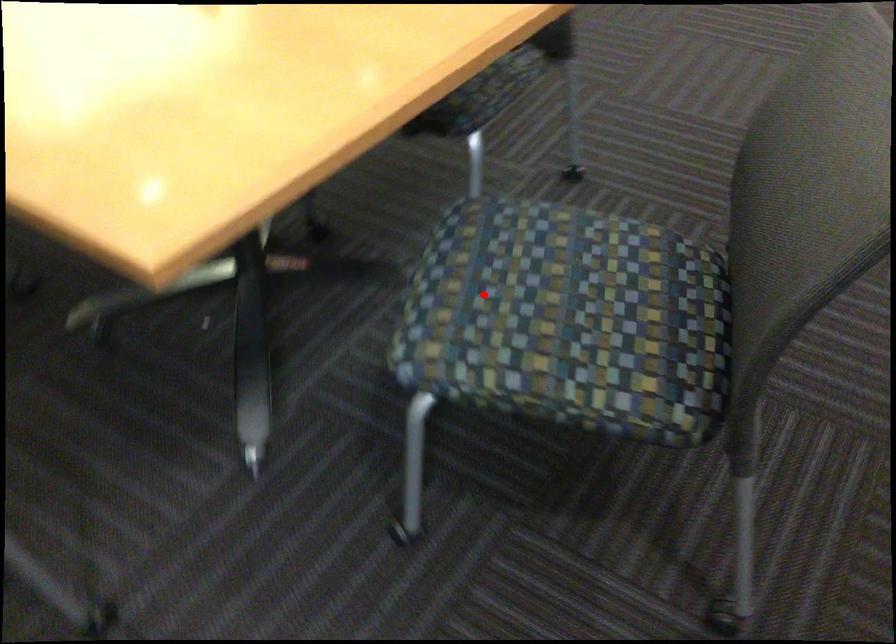
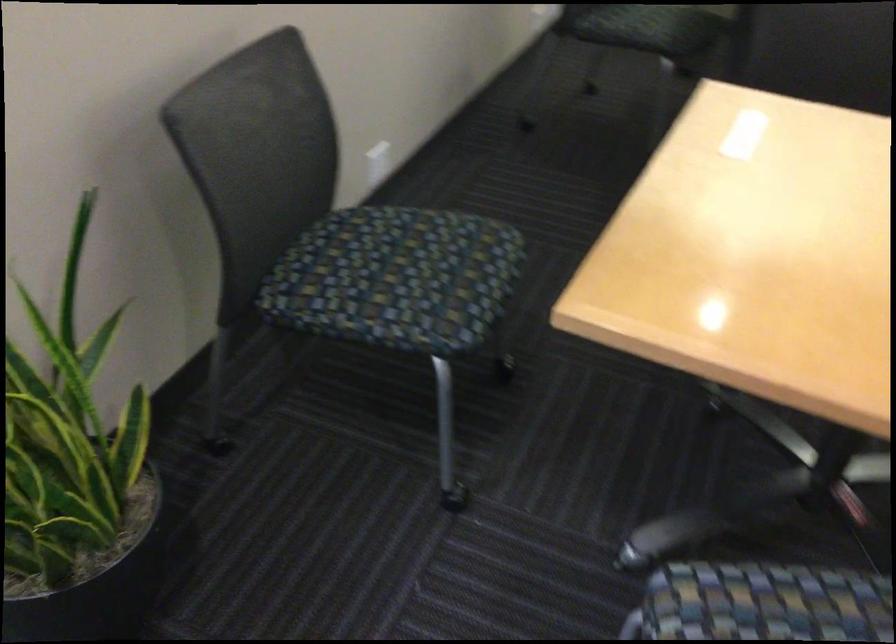
Question: I am providing you with two images of the same scene from different viewpoints. A red point is shown in image1. For the corresponding object point in image2, is it positioned nearer or farther from the camera?

Choices:
 (A) Nearer
 (B) Farther

Answer: (A)